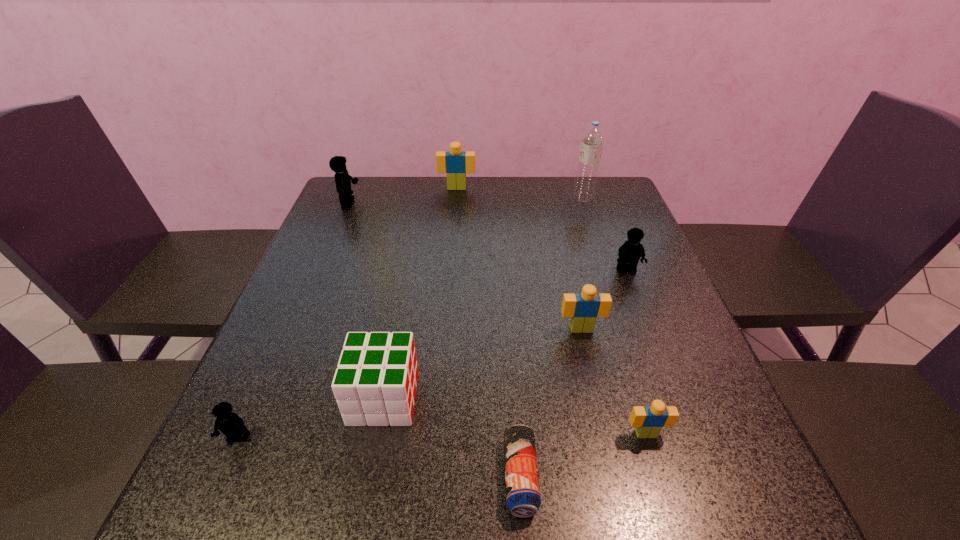
Find the location of a particular element. vacant area that lies between the fifth object from left to right and the biggest yellow Lego is located at coordinates (435, 340).

Locate an element on the screen. Image resolution: width=960 pixels, height=540 pixels. vacant space in between the water bottle and the smallest yellow Lego is located at coordinates (411, 318).

The width and height of the screenshot is (960, 540). What are the coordinates of `free spot between the rightmost Lego and the nearest yellow Lego` in the screenshot? It's located at (432, 354).

The height and width of the screenshot is (540, 960). I want to click on free point between the water bottle and the biggest beige Lego, so click(520, 193).

The width and height of the screenshot is (960, 540). Find the location of `vacant area that lies between the rightmost yellow Lego and the smallest beige Lego`. vacant area that lies between the rightmost yellow Lego and the smallest beige Lego is located at coordinates (636, 352).

Where is `object that stands as the third closest to the sixth farthest object`? object that stands as the third closest to the sixth farthest object is located at coordinates (584, 308).

Point out which object is positioned as the fourth nearest to the water bottle. Please provide its 2D coordinates. Your answer should be formatted as a tuple, i.e. [(x, y)], where the tuple contains the x and y coordinates of a point satisfying the conditions above.

[(337, 164)]

In order to click on Lego that can be found as the sixth closest to the cube in this screenshot , I will do `click(455, 163)`.

Choose which Lego is the fourth nearest neighbor to the third nearest Lego. Please provide its 2D coordinates. Your answer should be formatted as a tuple, i.e. [(x, y)], where the tuple contains the x and y coordinates of a point satisfying the conditions above.

[(230, 424)]

What are the coordinates of `beige Lego that can be found as the second closest to the second smallest beige Lego` in the screenshot? It's located at (455, 163).